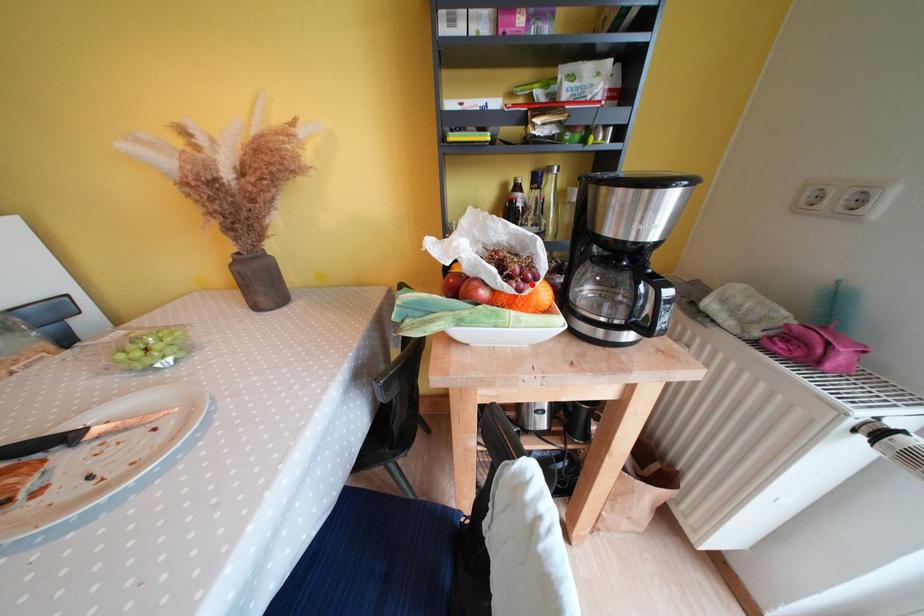
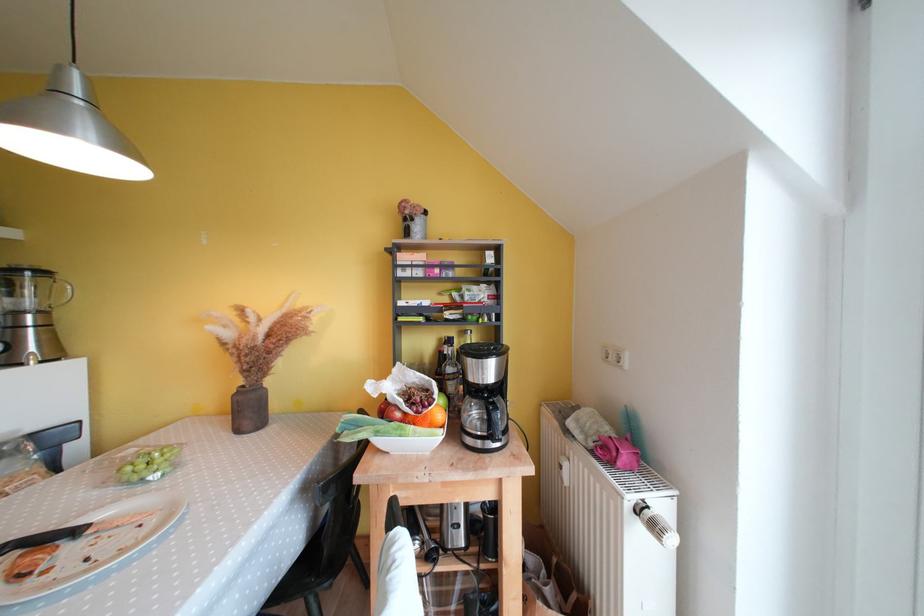
Find the pixel in the second image that matches the highlighted location in the first image.

(431, 411)